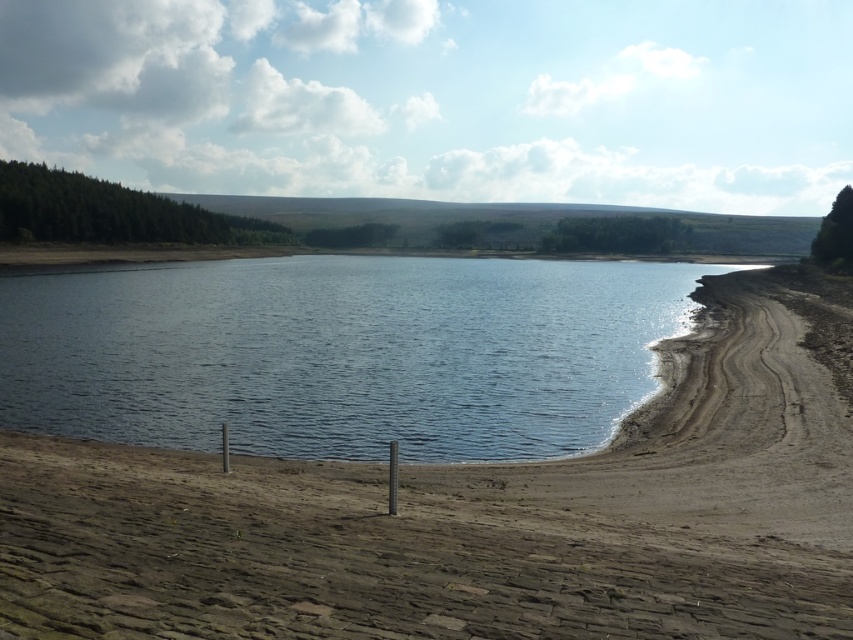
Question: Does brown/dry sand at lower center have a lesser width compared to blue water at center?

Choices:
 (A) no
 (B) yes

Answer: (B)

Question: Among these points, which one is farthest from the camera?

Choices:
 (A) (643, 296)
 (B) (490, 582)

Answer: (A)

Question: Can you confirm if brown/dry sand at lower center is positioned above blue water at center?

Choices:
 (A) no
 (B) yes

Answer: (A)

Question: Can you confirm if brown/dry sand at lower center is positioned below blue water at center?

Choices:
 (A) yes
 (B) no

Answer: (A)

Question: Which point is closer to the camera?

Choices:
 (A) brown/dry sand at lower center
 (B) blue water at center

Answer: (A)